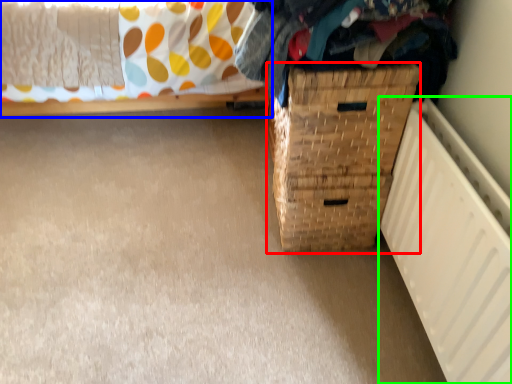
Question: Estimate the real-world distances between objects in this image. Which object is closer to basket container (highlighted by a red box), furniture (highlighted by a blue box) or radiator (highlighted by a green box)?

Choices:
 (A) furniture
 (B) radiator

Answer: (B)